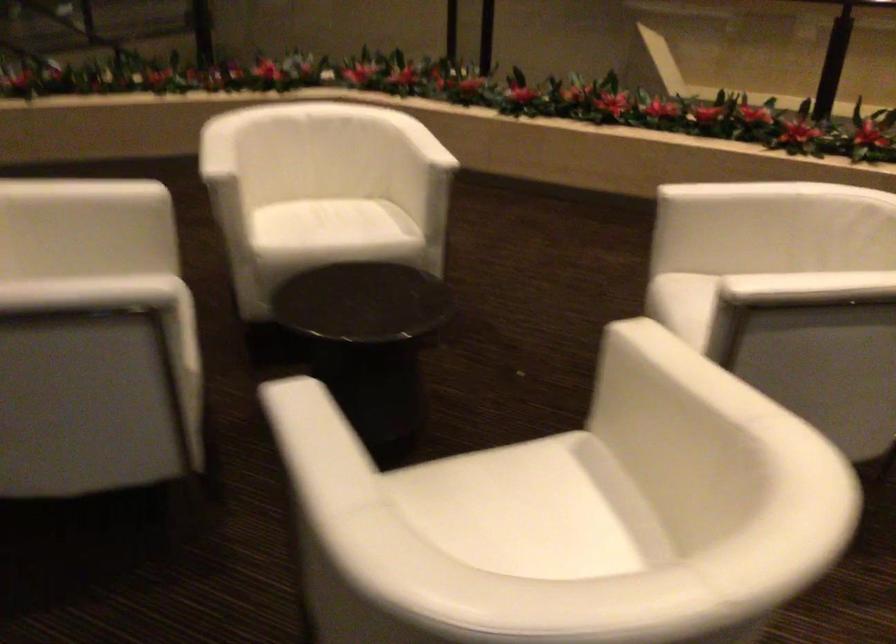
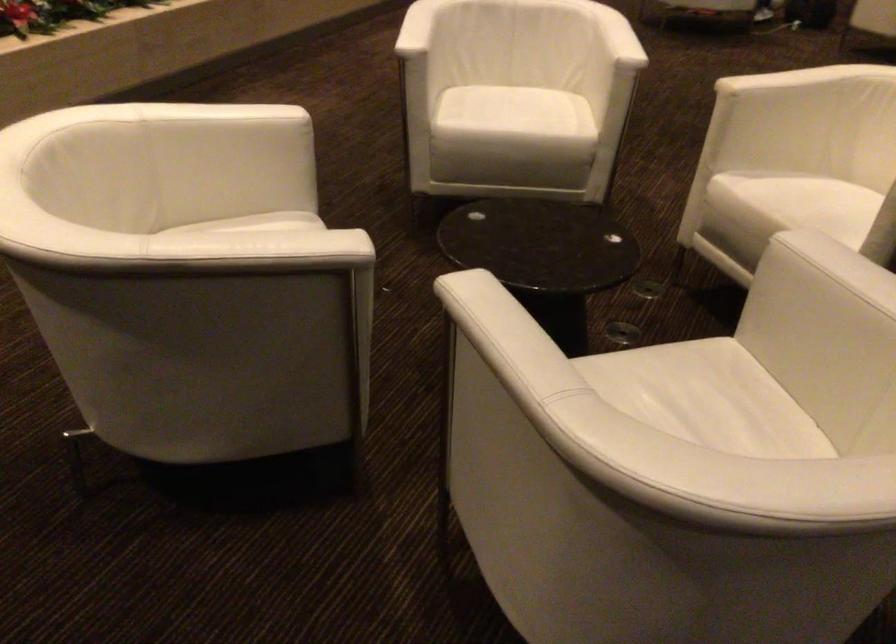
In the second image, find the point that corresponds to [92,194] in the first image.

(494, 322)